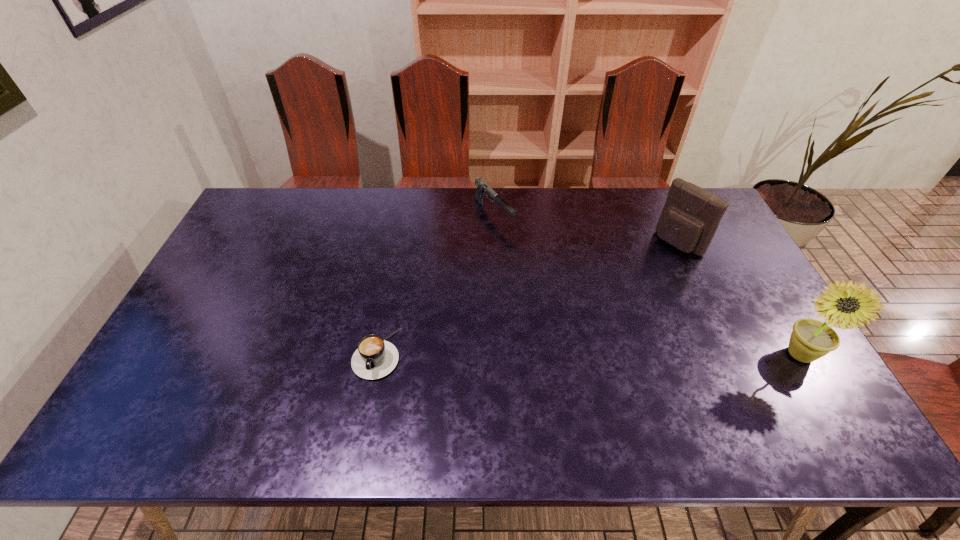
Where is `the leftmost object`? The height and width of the screenshot is (540, 960). the leftmost object is located at coordinates [375, 358].

Where is `the shortest object`? Image resolution: width=960 pixels, height=540 pixels. the shortest object is located at coordinates (375, 358).

Image resolution: width=960 pixels, height=540 pixels. In order to click on the tallest object in this screenshot , I will do `click(811, 339)`.

The width and height of the screenshot is (960, 540). In order to click on sunflower in this screenshot , I will do `click(811, 339)`.

Locate an element on the screen. the second shortest object is located at coordinates (483, 189).

Find the location of `gun`. gun is located at coordinates (483, 189).

Find the location of a particular element. This screenshot has width=960, height=540. pouch is located at coordinates (691, 215).

Locate an element on the screen. This screenshot has width=960, height=540. the second tallest object is located at coordinates (691, 215).

Where is `free location located 0.050m with the handle on the side of the shortest object`? The height and width of the screenshot is (540, 960). free location located 0.050m with the handle on the side of the shortest object is located at coordinates (368, 400).

Where is `vacant point located at the muzzle end of the gun`? The image size is (960, 540). vacant point located at the muzzle end of the gun is located at coordinates (573, 300).